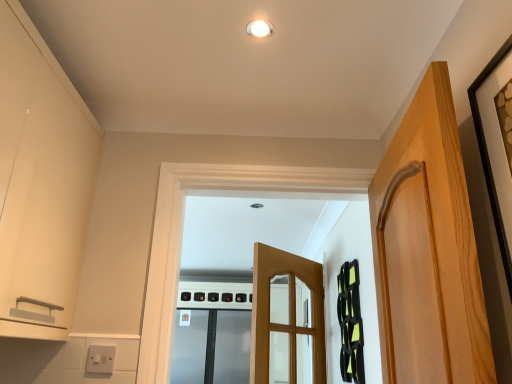
Question: From the image's perspective, is white glossy light fixture at upper center on stainless steel refrigerator at center?

Choices:
 (A) no
 (B) yes

Answer: (B)

Question: Is stainless steel refrigerator at center located within white glossy light fixture at upper center?

Choices:
 (A) yes
 (B) no

Answer: (B)

Question: Are white glossy light fixture at upper center and stainless steel refrigerator at center beside each other?

Choices:
 (A) no
 (B) yes

Answer: (A)

Question: Is there a large distance between white glossy light fixture at upper center and stainless steel refrigerator at center?

Choices:
 (A) yes
 (B) no

Answer: (A)

Question: Does white glossy light fixture at upper center turn towards stainless steel refrigerator at center?

Choices:
 (A) yes
 (B) no

Answer: (B)

Question: Is point (112, 365) closer or farther from the camera than point (389, 339)?

Choices:
 (A) farther
 (B) closer

Answer: (A)

Question: Is white plastic switch at lower left in front of or behind light wood door at right, marked as the first door in a front-to-back arrangement, in the image?

Choices:
 (A) behind
 (B) front

Answer: (A)

Question: In terms of width, does white plastic switch at lower left look wider or thinner when compared to light wood door at right, the second door in the back-to-front sequence?

Choices:
 (A) thin
 (B) wide

Answer: (A)

Question: From a real-world perspective, is white plastic switch at lower left positioned above or below light wood door at right, the second door in the back-to-front sequence?

Choices:
 (A) below
 (B) above

Answer: (A)

Question: From their relative heights in the image, would you say stainless steel refrigerator at center is taller or shorter than light brown wooden door at center, the 2th door positioned from the front?

Choices:
 (A) short
 (B) tall

Answer: (A)

Question: From a real-world perspective, is stainless steel refrigerator at center positioned above or below light brown wooden door at center, the 2th door positioned from the front?

Choices:
 (A) above
 (B) below

Answer: (B)

Question: Based on their positions, is stainless steel refrigerator at center located to the left or right of light brown wooden door at center, the 2th door positioned from the front?

Choices:
 (A) left
 (B) right

Answer: (A)

Question: Is stainless steel refrigerator at center inside the boundaries of light brown wooden door at center, positioned as the first door in back-to-front order, or outside?

Choices:
 (A) outside
 (B) inside

Answer: (A)

Question: Considering the positions of stainless steel refrigerator at center and black matte picture frame at upper right in the image, is stainless steel refrigerator at center wider or thinner than black matte picture frame at upper right?

Choices:
 (A) wide
 (B) thin

Answer: (A)

Question: From a real-world perspective, is stainless steel refrigerator at center physically located above or below black matte picture frame at upper right?

Choices:
 (A) above
 (B) below

Answer: (B)